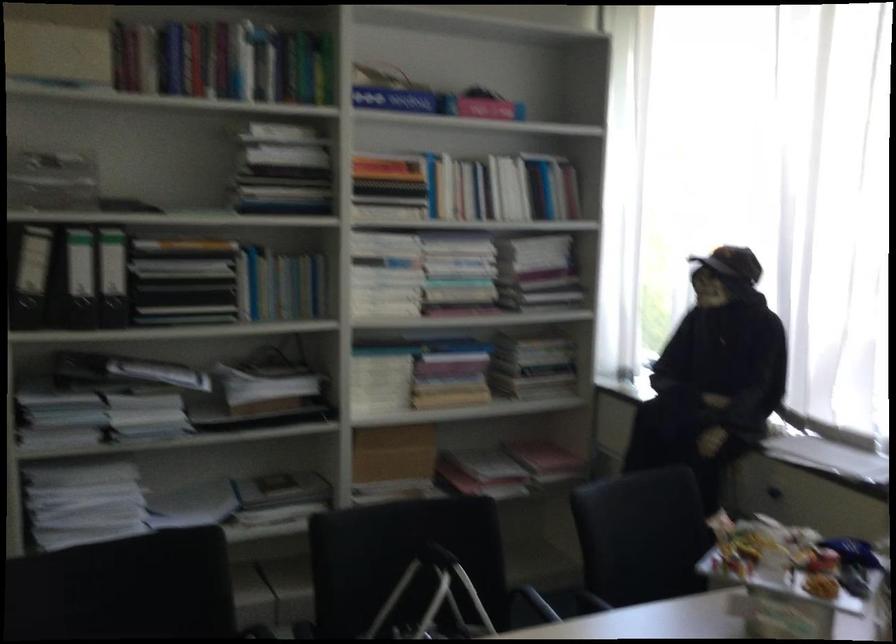
Find the location of a particular element. The width and height of the screenshot is (896, 644). chair armrest is located at coordinates (540, 579).